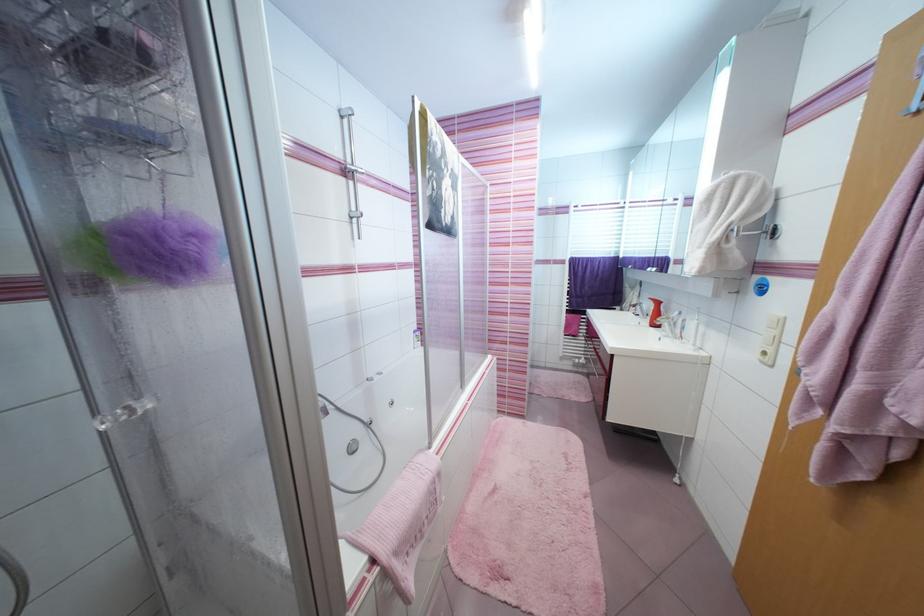
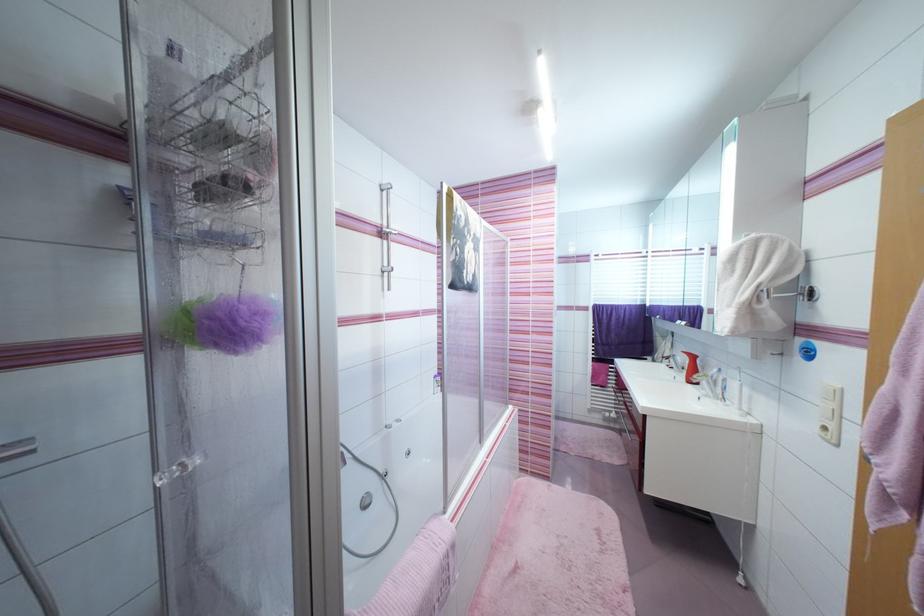
The point at (804,416) is marked in the first image. Where is the corresponding point in the second image?

(883, 517)